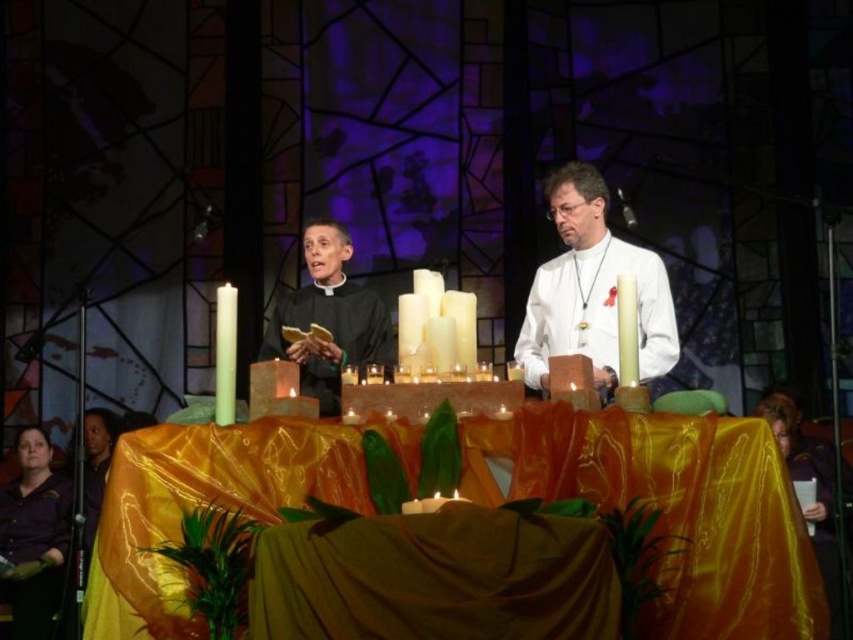
You are a guest at this event and want to move from the purple satin robe at lower left to the white glossy candle at center. Can you walk directly between them without any obstacles?

The distance between the purple satin robe at lower left and the white glossy candle at center is 30.07 meters, so you can walk directly between them without any obstacles since there is enough space.

You are organizing a small event and need to determine if the purple satin robe at lower left can be placed on the silky gold tablecloth at center without folding. Based on their sizes, what would you advise?

The silky gold tablecloth at center has a larger width than the purple satin robe at lower left, so the robe can be placed on the tablecloth without needing to fold it.